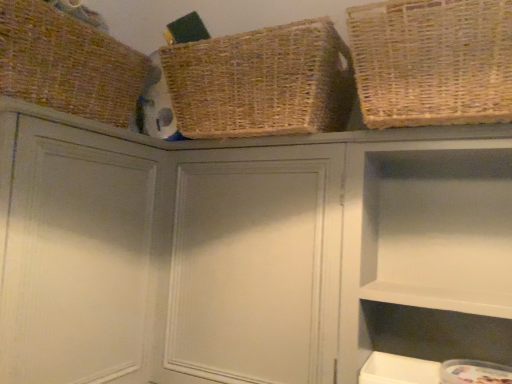
Locate an element on the screen. Image resolution: width=512 pixels, height=384 pixels. matte gray cabinet at upper left, the 3th cabinet from the right is located at coordinates (76, 257).

How much space does brown woven basket at upper left, positioned as the third basket in right-to-left order, occupy vertically?

brown woven basket at upper left, positioned as the third basket in right-to-left order, is 11.19 inches in height.

Locate an element on the screen. The image size is (512, 384). white matte cabinet at upper right, the third cabinet from the left is located at coordinates (425, 258).

From the image's perspective, which cabinet is the 3rd one below the woven natural basket at upper center, arranged as the 2th basket when viewed from the left? Please provide its 2D coordinates.

[(255, 264)]

Between woven natural basket at upper center, the second basket positioned from the right, and matte gray cabinet at center, positioned as the second cabinet in right-to-left order, which one has smaller width?

matte gray cabinet at center, positioned as the second cabinet in right-to-left order, is thinner.

Would you say woven natural basket at upper center, arranged as the 2th basket when viewed from the left, contains matte gray cabinet at center, the second cabinet in the left-to-right sequence?

No, woven natural basket at upper center, arranged as the 2th basket when viewed from the left, does not contain matte gray cabinet at center, the second cabinet in the left-to-right sequence.

Would you say matte gray cabinet at upper left, which appears as the first cabinet when viewed from the left, contains brown woven basket at upper left, positioned as the third basket in right-to-left order?

Definitely not — brown woven basket at upper left, positioned as the third basket in right-to-left order, is not inside matte gray cabinet at upper left, which appears as the first cabinet when viewed from the left.

Could you tell me if matte gray cabinet at upper left, which appears as the first cabinet when viewed from the left, is turned towards brown woven basket at upper left, which appears as the first basket when viewed from the left?

No, matte gray cabinet at upper left, which appears as the first cabinet when viewed from the left, does not turn towards brown woven basket at upper left, which appears as the first basket when viewed from the left.

Considering the relative sizes of matte gray cabinet at upper left, which appears as the first cabinet when viewed from the left, and brown woven basket at upper left, positioned as the third basket in right-to-left order, in the image provided, is matte gray cabinet at upper left, which appears as the first cabinet when viewed from the left, bigger than brown woven basket at upper left, positioned as the third basket in right-to-left order,?

Yes, matte gray cabinet at upper left, which appears as the first cabinet when viewed from the left, is bigger than brown woven basket at upper left, positioned as the third basket in right-to-left order.

From a real-world perspective, relative to natural woven basket at upper right, acting as the third basket starting from the left, is white matte cabinet at upper right, the third cabinet from the left, vertically above or below?

Clearly, from a real-world perspective, white matte cabinet at upper right, the third cabinet from the left, is below natural woven basket at upper right, acting as the third basket starting from the left.

Is white matte cabinet at upper right, the third cabinet from the left, not near natural woven basket at upper right, acting as the third basket starting from the left?

No, white matte cabinet at upper right, the third cabinet from the left, is not far from natural woven basket at upper right, acting as the third basket starting from the left.

Does white matte cabinet at upper right, the first cabinet positioned from the right, have a greater width compared to natural woven basket at upper right, acting as the third basket starting from the left?

Incorrect, the width of white matte cabinet at upper right, the first cabinet positioned from the right, does not surpass that of natural woven basket at upper right, acting as the third basket starting from the left.

From a real-world perspective, relative to natural woven basket at upper right, which is the first basket in right-to-left order, is brown woven basket at upper left, positioned as the third basket in right-to-left order, vertically above or below?

Clearly, from a real-world perspective, brown woven basket at upper left, positioned as the third basket in right-to-left order, is above natural woven basket at upper right, which is the first basket in right-to-left order.

Is the depth of brown woven basket at upper left, positioned as the third basket in right-to-left order, greater than that of natural woven basket at upper right, acting as the third basket starting from the left?

Yes, brown woven basket at upper left, positioned as the third basket in right-to-left order, is behind natural woven basket at upper right, acting as the third basket starting from the left.

Choose the correct answer: Is brown woven basket at upper left, positioned as the third basket in right-to-left order, inside natural woven basket at upper right, which is the first basket in right-to-left order, or outside it?

The correct answer is: outside.

Which is further, (91, 59) or (487, 24)?

The point (91, 59) is more distant.

In order to click on cabinet that appears behind the brown woven basket at upper left, positioned as the third basket in right-to-left order in this screenshot , I will do `click(255, 264)`.

From the image's perspective, which object appears higher, brown woven basket at upper left, which appears as the first basket when viewed from the left, or matte gray cabinet at center, positioned as the second cabinet in right-to-left order?

brown woven basket at upper left, which appears as the first basket when viewed from the left.

From a real-world perspective, which is physically below, brown woven basket at upper left, positioned as the third basket in right-to-left order, or matte gray cabinet at center, positioned as the second cabinet in right-to-left order?

matte gray cabinet at center, positioned as the second cabinet in right-to-left order.

How many degrees apart are the facing directions of brown woven basket at upper left, which appears as the first basket when viewed from the left, and matte gray cabinet at center, positioned as the second cabinet in right-to-left order?

The facing directions of brown woven basket at upper left, which appears as the first basket when viewed from the left, and matte gray cabinet at center, positioned as the second cabinet in right-to-left order, are 89.8 degrees apart.

Is point (36, 134) less distant than point (440, 355)?

Yes, it is in front of point (440, 355).

Is matte gray cabinet at upper left, which appears as the first cabinet when viewed from the left, at the left side of white matte cabinet at upper right, the third cabinet from the left?

Yes.

Which object is more forward, matte gray cabinet at upper left, which appears as the first cabinet when viewed from the left, or white matte cabinet at upper right, the third cabinet from the left?

matte gray cabinet at upper left, which appears as the first cabinet when viewed from the left, is closer to the camera.

Considering the relative sizes of matte gray cabinet at upper left, which appears as the first cabinet when viewed from the left, and white matte cabinet at upper right, the third cabinet from the left, in the image provided, is matte gray cabinet at upper left, which appears as the first cabinet when viewed from the left, smaller than white matte cabinet at upper right, the third cabinet from the left,?

No.

Is there a large distance between matte gray cabinet at center, the second cabinet in the left-to-right sequence, and matte gray cabinet at upper left, the 3th cabinet from the right?

No, matte gray cabinet at center, the second cabinet in the left-to-right sequence, is not far away from matte gray cabinet at upper left, the 3th cabinet from the right.

Is matte gray cabinet at center, the second cabinet in the left-to-right sequence, taller or shorter than matte gray cabinet at upper left, the 3th cabinet from the right?

Clearly, matte gray cabinet at center, the second cabinet in the left-to-right sequence, is shorter compared to matte gray cabinet at upper left, the 3th cabinet from the right.

Consider the image. Is matte gray cabinet at center, the second cabinet in the left-to-right sequence, wider than matte gray cabinet at upper left, the 3th cabinet from the right?

In fact, matte gray cabinet at center, the second cabinet in the left-to-right sequence, might be narrower than matte gray cabinet at upper left, the 3th cabinet from the right.

Locate an element on the screen. cabinet beneath the matte gray cabinet at center, positioned as the second cabinet in right-to-left order (from a real-world perspective) is located at coordinates (76, 257).

Which cabinet is the 1st one when counting from the left side of the woven natural basket at upper center, the second basket positioned from the right? Please provide its 2D coordinates.

[(255, 264)]

From the image's perspective, starting from the brown woven basket at upper left, positioned as the third basket in right-to-left order, which cabinet is the 2nd one below? Please provide its 2D coordinates.

[(76, 257)]

From the image, which object appears to be nearer to white matte cabinet at upper right, the first cabinet positioned from the right, matte gray cabinet at center, the second cabinet in the left-to-right sequence, or brown woven basket at upper left, which appears as the first basket when viewed from the left?

matte gray cabinet at center, the second cabinet in the left-to-right sequence, lies closer to white matte cabinet at upper right, the first cabinet positioned from the right, than the other object.

From the image, which object appears to be nearer to woven natural basket at upper center, arranged as the 2th basket when viewed from the left, matte gray cabinet at center, positioned as the second cabinet in right-to-left order, or brown woven basket at upper left, which appears as the first basket when viewed from the left?

The object closer to woven natural basket at upper center, arranged as the 2th basket when viewed from the left, is matte gray cabinet at center, positioned as the second cabinet in right-to-left order.

Estimate the real-world distances between objects in this image. Which object is further from matte gray cabinet at upper left, which appears as the first cabinet when viewed from the left, brown woven basket at upper left, which appears as the first basket when viewed from the left, or woven natural basket at upper center, the second basket positioned from the right?

The object further to matte gray cabinet at upper left, which appears as the first cabinet when viewed from the left, is woven natural basket at upper center, the second basket positioned from the right.

Considering their positions, is woven natural basket at upper center, arranged as the 2th basket when viewed from the left, positioned closer to white matte cabinet at upper right, the first cabinet positioned from the right, than matte gray cabinet at center, positioned as the second cabinet in right-to-left order?

The object closer to white matte cabinet at upper right, the first cabinet positioned from the right, is matte gray cabinet at center, positioned as the second cabinet in right-to-left order.

Based on their spatial positions, is white matte cabinet at upper right, the first cabinet positioned from the right, or brown woven basket at upper left, which appears as the first basket when viewed from the left, further from woven natural basket at upper center, the second basket positioned from the right?

Based on the image, white matte cabinet at upper right, the first cabinet positioned from the right, appears to be further to woven natural basket at upper center, the second basket positioned from the right.

Consider the image. Looking at the image, which one is located further to matte gray cabinet at upper left, which appears as the first cabinet when viewed from the left, natural woven basket at upper right, which is the first basket in right-to-left order, or white matte cabinet at upper right, the third cabinet from the left?

natural woven basket at upper right, which is the first basket in right-to-left order.

Which object lies nearer to the anchor point matte gray cabinet at upper left, which appears as the first cabinet when viewed from the left, brown woven basket at upper left, positioned as the third basket in right-to-left order, or matte gray cabinet at center, positioned as the second cabinet in right-to-left order?

brown woven basket at upper left, positioned as the third basket in right-to-left order, is positioned closer to the anchor matte gray cabinet at upper left, which appears as the first cabinet when viewed from the left.

From the image, which object appears to be farther from woven natural basket at upper center, arranged as the 2th basket when viewed from the left, matte gray cabinet at upper left, which appears as the first cabinet when viewed from the left, or brown woven basket at upper left, which appears as the first basket when viewed from the left?

matte gray cabinet at upper left, which appears as the first cabinet when viewed from the left, is positioned further to the anchor woven natural basket at upper center, arranged as the 2th basket when viewed from the left.

At what (x,y) coordinates should I click in order to perform the action: click on cabinet between matte gray cabinet at upper left, the 3th cabinet from the right, and natural woven basket at upper right, acting as the third basket starting from the left, from left to right. Please return your answer as a coordinate pair (x, y). This screenshot has height=384, width=512. Looking at the image, I should click on (255, 264).

The image size is (512, 384). What are the coordinates of `basket between brown woven basket at upper left, positioned as the third basket in right-to-left order, and natural woven basket at upper right, acting as the third basket starting from the left, from left to right` in the screenshot? It's located at (261, 82).

I want to click on basket between woven natural basket at upper center, the second basket positioned from the right, and matte gray cabinet at center, the second cabinet in the left-to-right sequence, from top to bottom, so click(x=432, y=61).

At what (x,y) coordinates should I click in order to perform the action: click on basket between woven natural basket at upper center, the second basket positioned from the right, and white matte cabinet at upper right, the first cabinet positioned from the right, vertically. Please return your answer as a coordinate pair (x, y). The width and height of the screenshot is (512, 384). Looking at the image, I should click on (432, 61).